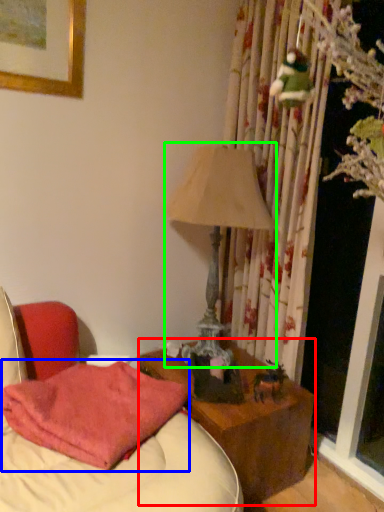
Question: Based on their relative distances, which object is nearer to nightstand (highlighted by a red box)? Choose from pillow (highlighted by a blue box) and table lamp (highlighted by a green box).

Choices:
 (A) pillow
 (B) table lamp

Answer: (A)